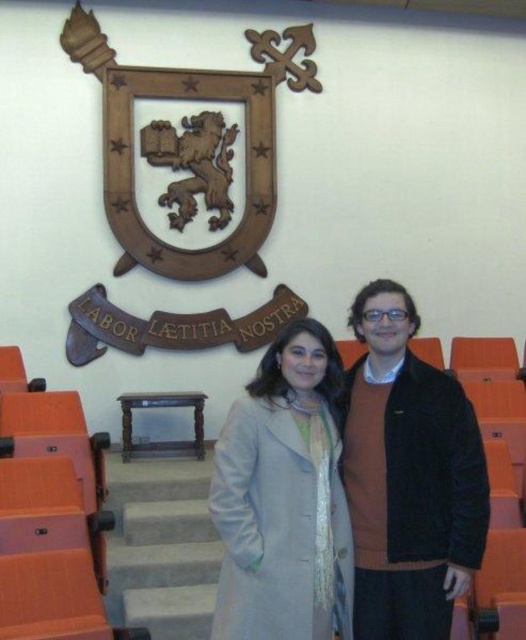
Looking at this image, you are organizing a formal event and need to ensure that the velvet brown jacket at center and the light gray wool coat at center are displayed properly. Which item should be placed first if you want to follow the current arrangement seen in the image?

The velvet brown jacket at center should be placed first because it is positioned over the light gray wool coat at center in the image.

You are an event organizer arranging a photo shoot for two guests. You need to position them so that their jackets are clearly visible. Given their current positions with the velvet brown jacket at center and the light gray wool coat at center, which jacket will appear larger in the photo?

The velvet brown jacket at center will appear larger in the photo because it is closer to the viewer than the light gray wool coat at center.